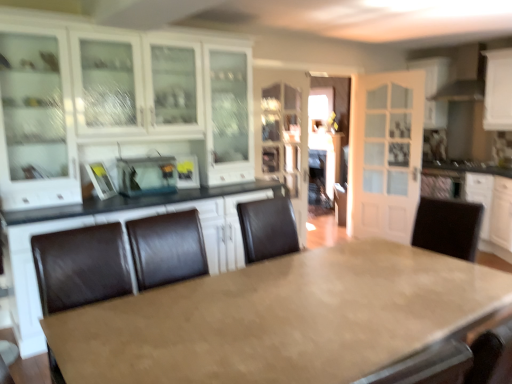
Question: Does white glossy exhaust hood at upper right have a greater height compared to matte brown table at center?

Choices:
 (A) no
 (B) yes

Answer: (A)

Question: From a real-world perspective, is white glossy exhaust hood at upper right below matte brown table at center?

Choices:
 (A) no
 (B) yes

Answer: (A)

Question: Can you confirm if white glossy exhaust hood at upper right is thinner than matte brown table at center?

Choices:
 (A) no
 (B) yes

Answer: (B)

Question: Can we say white glossy exhaust hood at upper right lies outside matte brown table at center?

Choices:
 (A) yes
 (B) no

Answer: (A)

Question: Can you confirm if white glossy exhaust hood at upper right is bigger than matte brown table at center?

Choices:
 (A) no
 (B) yes

Answer: (A)

Question: From the image's perspective, is white glossy cabinet at upper right, which appears as the 4th cabinetry when viewed from the left, located above or below metallic silver toaster at center, which is the 1th appliance from left to right?

Choices:
 (A) above
 (B) below

Answer: (A)

Question: Is white glossy cabinet at upper right, which is counted as the 1th cabinetry, starting from the right, bigger or smaller than metallic silver toaster at center, the second appliance in the right-to-left sequence?

Choices:
 (A) small
 (B) big

Answer: (B)

Question: Is white glossy cabinet at upper right, which appears as the 4th cabinetry when viewed from the left, taller or shorter than metallic silver toaster at center, the second appliance in the right-to-left sequence?

Choices:
 (A) tall
 (B) short

Answer: (A)

Question: Is white glossy cabinet at upper right, which appears as the 4th cabinetry when viewed from the left, in front of or behind metallic silver toaster at center, which is the 1th appliance from left to right, in the image?

Choices:
 (A) front
 (B) behind

Answer: (B)

Question: Is point (165, 182) closer or farther from the camera than point (178, 178)?

Choices:
 (A) farther
 (B) closer

Answer: (B)

Question: Is metallic silver toaster at center, the second appliance in the right-to-left sequence, situated inside matte black toaster at center, which is the first appliance in right-to-left order, or outside?

Choices:
 (A) inside
 (B) outside

Answer: (B)

Question: From the image's perspective, is metallic silver toaster at center, which is the 1th appliance from left to right, positioned above or below matte black toaster at center, which is the 2th appliance from left to right?

Choices:
 (A) above
 (B) below

Answer: (B)

Question: Is metallic silver toaster at center, the second appliance in the right-to-left sequence, bigger or smaller than matte black toaster at center, which is the 2th appliance from left to right?

Choices:
 (A) small
 (B) big

Answer: (B)

Question: From the image's perspective, relative to metallic silver toaster at center, the second appliance in the right-to-left sequence, is matte black toaster at center, which is the 2th appliance from left to right, above or below?

Choices:
 (A) above
 (B) below

Answer: (A)

Question: Looking at their shapes, would you say matte black toaster at center, which is the first appliance in right-to-left order, is wider or thinner than metallic silver toaster at center, the second appliance in the right-to-left sequence?

Choices:
 (A) thin
 (B) wide

Answer: (A)